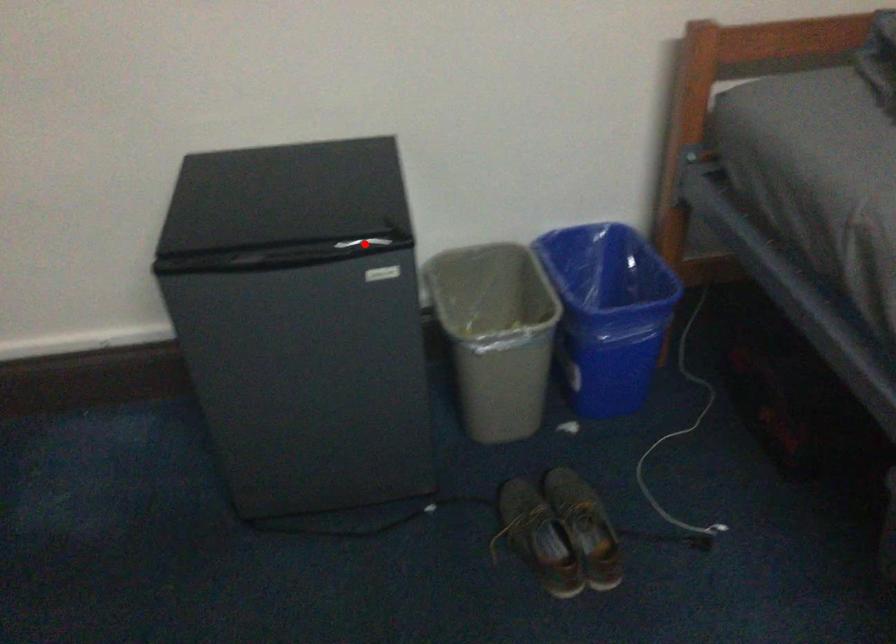
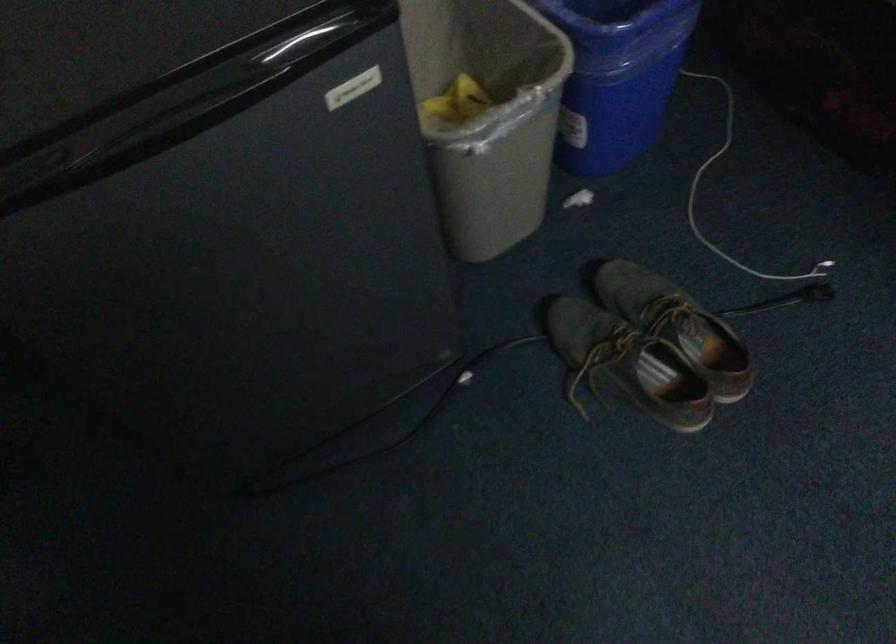
Locate, in the second image, the point that corresponds to the highlighted location in the first image.

(309, 40)